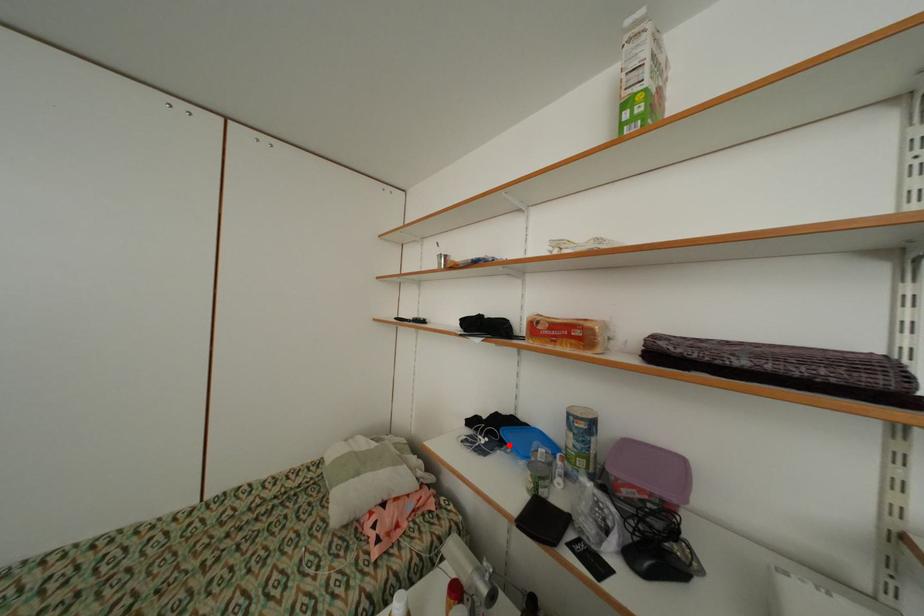
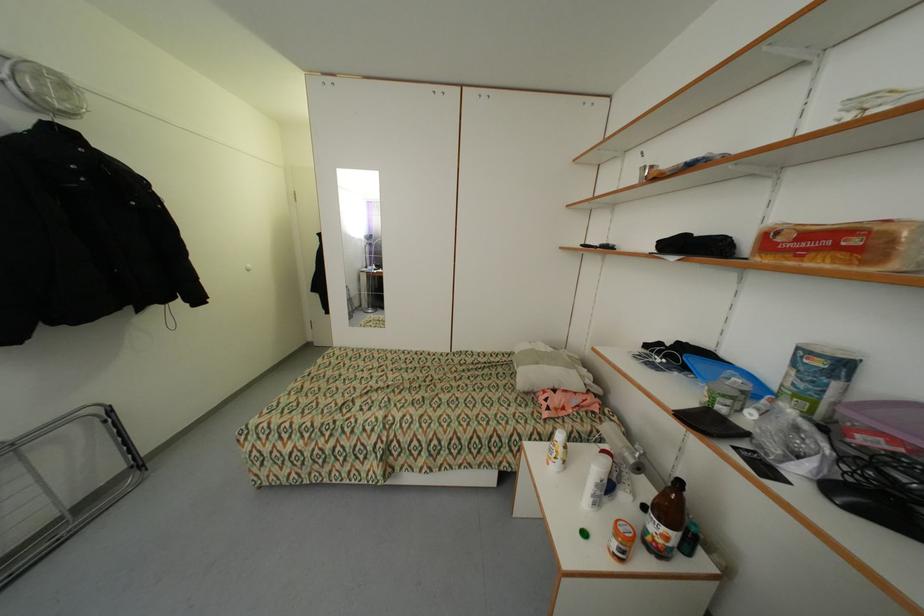
In the second image, find the point that corresponds to the highlighted location in the first image.

(690, 369)